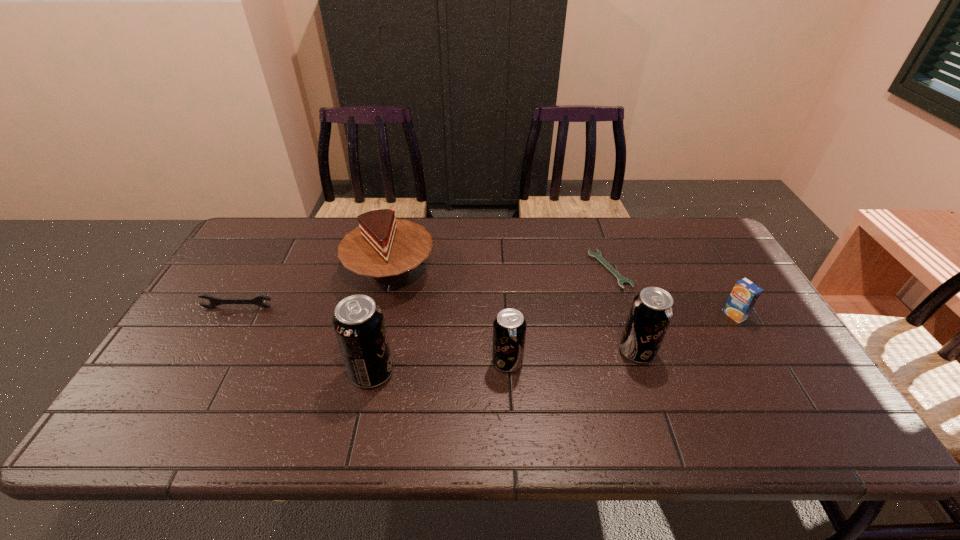
Where is `object that is at the left edge`? object that is at the left edge is located at coordinates (257, 300).

Locate an element on the screen. object present at the right edge is located at coordinates (745, 294).

Identify the location of vacant space at the far edge of the desktop. (314, 227).

In the image, there is a desktop. At what (x,y) coordinates should I click in order to perform the action: click on vacant space at the left edge. Please return your answer as a coordinate pair (x, y). This screenshot has height=540, width=960. Looking at the image, I should click on (215, 318).

In the image, there is a desktop. Where is `vacant space at the right edge`? Image resolution: width=960 pixels, height=540 pixels. vacant space at the right edge is located at coordinates (731, 277).

In the image, there is a desktop. At what (x,y) coordinates should I click in order to perform the action: click on vacant area at the far left corner. Please return your answer as a coordinate pair (x, y). Looking at the image, I should click on (300, 219).

At what (x,y) coordinates should I click in order to perform the action: click on vacant region at the far right corner. Please return your answer as a coordinate pair (x, y). This screenshot has width=960, height=540. Looking at the image, I should click on (698, 232).

In order to click on vacant space at the near right corner of the desktop in this screenshot , I will do `click(749, 386)`.

Locate an element on the screen. The height and width of the screenshot is (540, 960). vacant point located between the right wrench and the rightmost object is located at coordinates pyautogui.click(x=672, y=292).

You are a GUI agent. You are given a task and a screenshot of the screen. Output one action in this format:
    pyautogui.click(x=<x>, y=<y>)
    Task: Click on the vacant space that's between the shorter wrench and the rightmost soda can
    The image size is (960, 540).
    Given the screenshot: What is the action you would take?
    pyautogui.click(x=623, y=310)